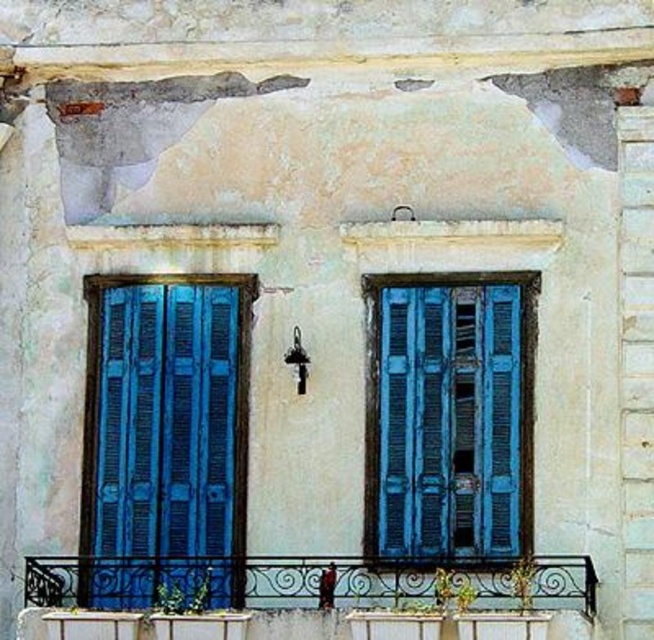
You are an architect assessing the building facade. You need to determine which object, the blue wooden shutters at left or the wrought iron balcony at lower center, extends higher vertically. Based on the scene description, which one is taller?

The blue wooden shutters at left has a greater height compared to the wrought iron balcony at lower center, so the blue wooden shutters at left is taller.

You are an architect assessing the building facade. You need to determine which of the two blue features is taller for structural analysis. Which is taller, the blue wooden shutters at left or the blue wooden window at center?

The blue wooden shutters at left is taller than the blue wooden window at center according to the description provided.

You are standing in front of a weathered building facade with two windows. There is a point marked at coordinates [449,419]. What object is located at that point?

The blue wooden window at center is located at point [449,419].